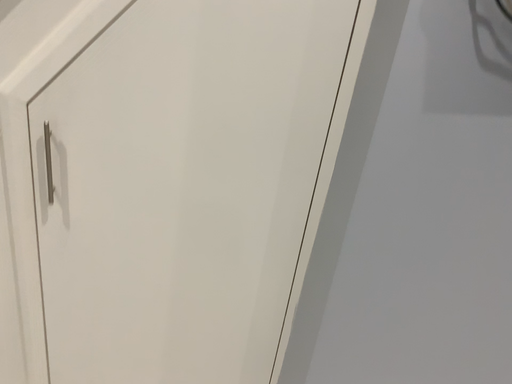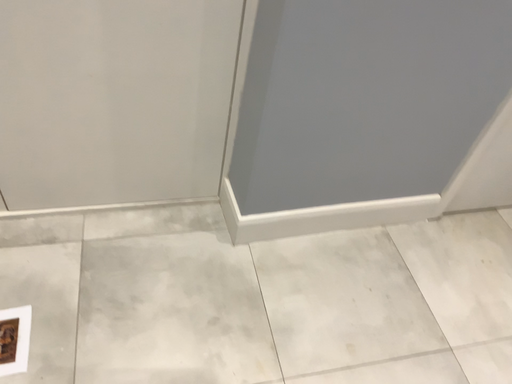
Question: How did the camera likely rotate when shooting the video?

Choices:
 (A) rotated downward
 (B) rotated upward

Answer: (A)